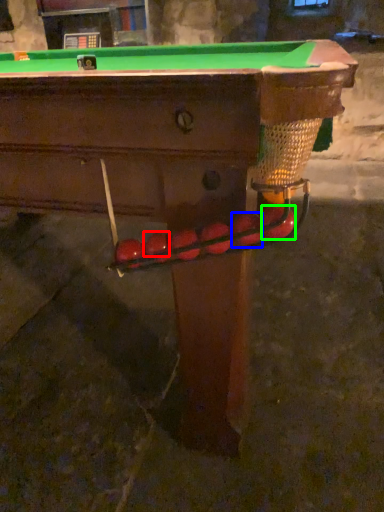
Question: Which is nearer to the fruit (highlighted by a red box)? fruit (highlighted by a blue box) or fruit (highlighted by a green box).

Choices:
 (A) fruit
 (B) fruit

Answer: (A)